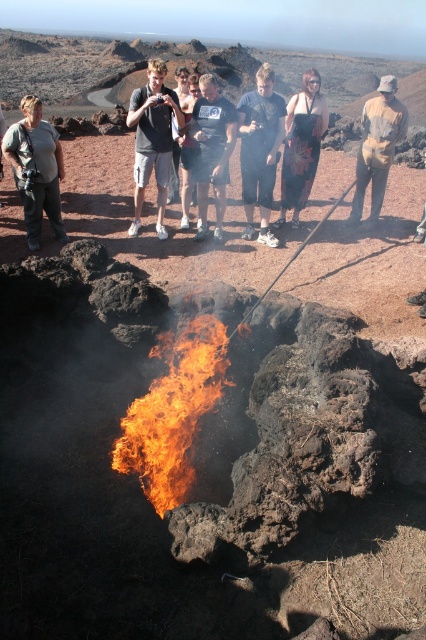
You are a photographer aiming to capture the orange flame in the background. You have two subjects wearing a black cotton shirt at center and a brown leather jacket at right. To ensure both are visible in the frame, which subject should you position closer to the flame?

The black cotton shirt at center is below the brown leather jacket at right, so positioning the black cotton shirt at center closer to the flame would ensure both subjects are visible as the lower positioned subject is nearer to the flame.